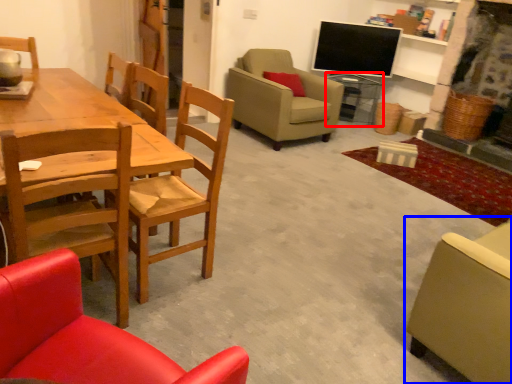
Question: Which object appears closest to the camera in this image, side table (highlighted by a red box) or chair (highlighted by a blue box)?

Choices:
 (A) side table
 (B) chair

Answer: (B)